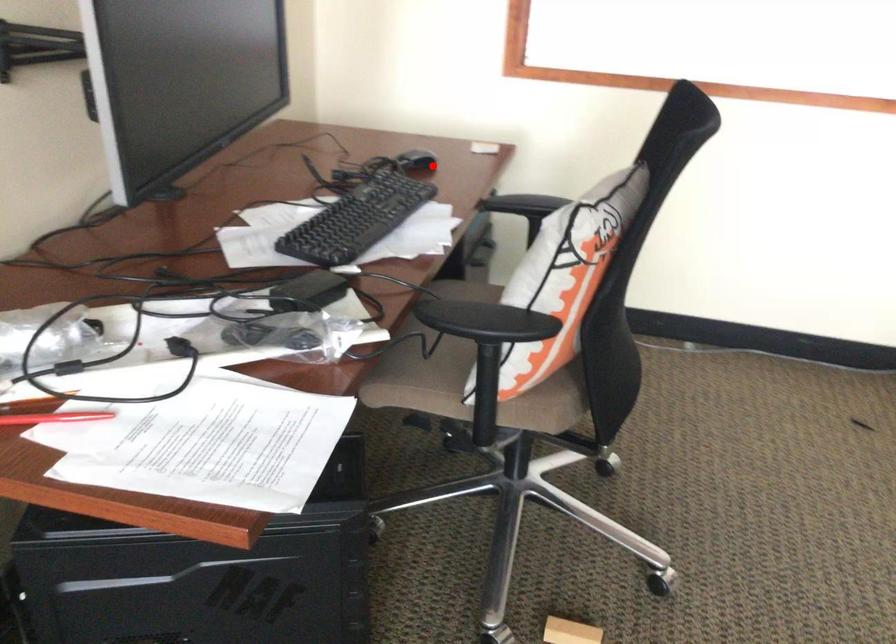
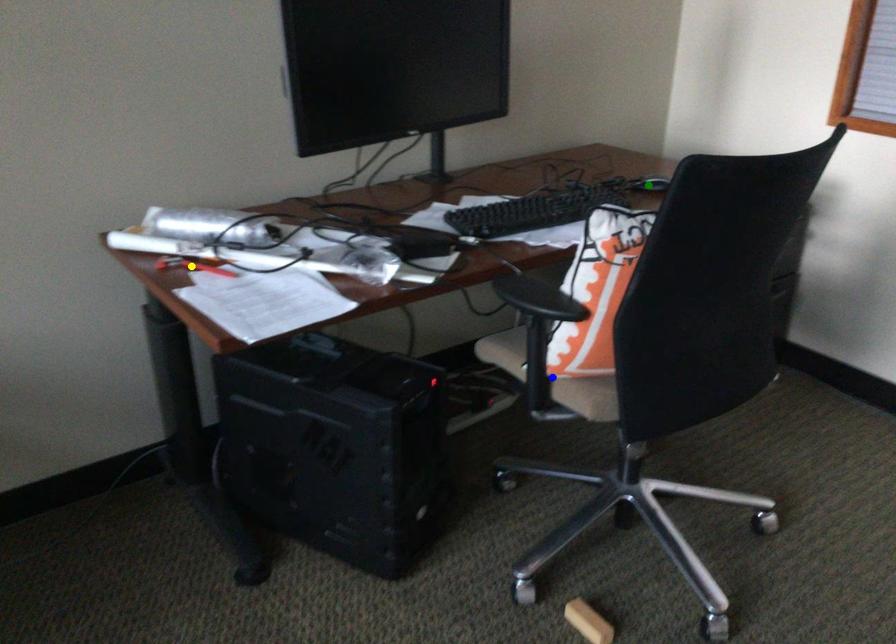
Question: I am providing you with two images of the same scene from different viewpoints. A red point is marked on the first image. You are given multiple points on the second image. Which point in image 2 is actually the same real-world point as the red point in image 1?

Choices:
 (A) green point
 (B) yellow point
 (C) blue point

Answer: (A)